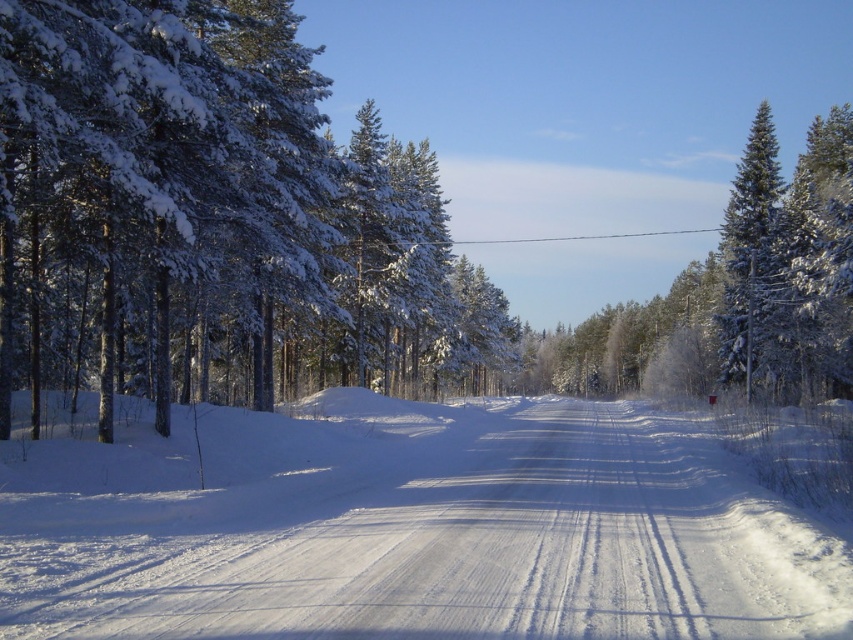
Question: Among these points, which one is farthest from the camera?

Choices:
 (A) [x=410, y=260]
 (B) [x=759, y=131]

Answer: (B)

Question: Which object is the closest to the snow-covered pine trees at left?

Choices:
 (A) white snow-covered dirt track at center
 (B) green snow-covered tree at right

Answer: (A)

Question: Does white snow-covered dirt track at center come behind snow-covered pine trees at left?

Choices:
 (A) no
 (B) yes

Answer: (A)

Question: Which object appears closest to the camera in this image?

Choices:
 (A) white snow-covered dirt track at center
 (B) green snow-covered tree at right

Answer: (A)

Question: Does white snow-covered dirt track at center have a lesser width compared to snow-covered pine trees at left?

Choices:
 (A) no
 (B) yes

Answer: (B)

Question: Can you confirm if snow-covered pine trees at left is thinner than green snow-covered tree at right?

Choices:
 (A) yes
 (B) no

Answer: (A)